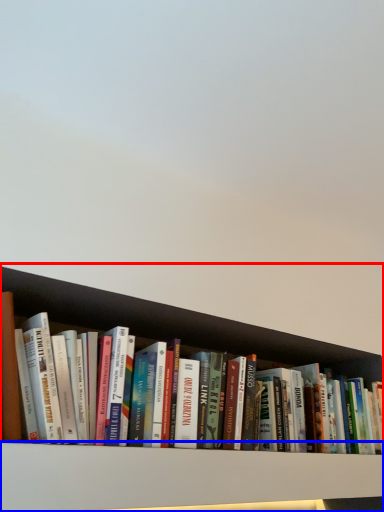
Question: Which point is closer to the camera, shelf (highlighted by a red box) or shelf (highlighted by a blue box)?

Choices:
 (A) shelf
 (B) shelf

Answer: (B)